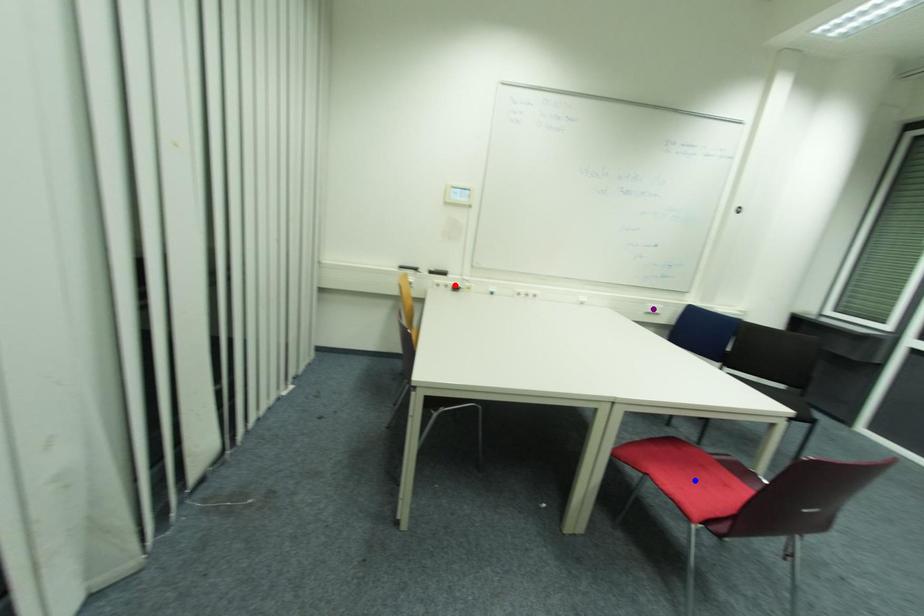
Looking at this image, order these from nearest to farthest:
1. blue point
2. purple point
3. red point

blue point, red point, purple point